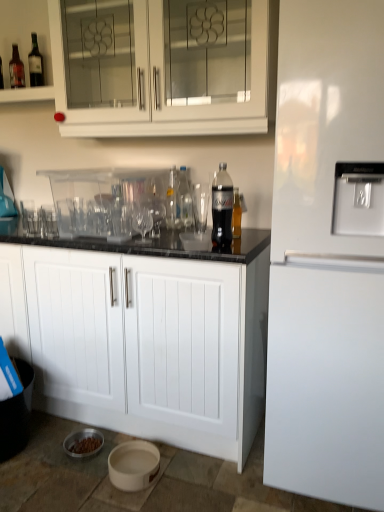
Question: In terms of width, does white glass cabinet at upper center, the first cabinetry when ordered from top to bottom, look wider or thinner when compared to transparent glass shot glass at center, the 2th shot glass in the left-to-right sequence?

Choices:
 (A) wide
 (B) thin

Answer: (A)

Question: From a real-world perspective, relative to transparent glass shot glass at center, the 2th shot glass in the left-to-right sequence, is white glass cabinet at upper center, the second cabinetry in the bottom-to-top sequence, vertically above or below?

Choices:
 (A) above
 (B) below

Answer: (A)

Question: Which of these objects is positioned closest to the white glass cabinet at upper center, the first cabinetry when ordered from top to bottom?

Choices:
 (A) clear glass wine glass at center, which appears as the first wine glass when viewed from the right
 (B) white glossy refrigerator at right
 (C) clear glass bottle at center, which ranks as the third bottle in right-to-left order
 (D) transparent plastic drinking straw at center, which is the 1th drinking straw in front-to-back order
 (E) transparent glass wine glass at center, the 1th wine glass in the left-to-right sequence

Answer: (C)

Question: Which is farther from the white glossy refrigerator at right?

Choices:
 (A) transparent glass wine glass at center, the 2th wine glass viewed from the right
 (B) white glass cabinet at upper center, the second cabinetry in the bottom-to-top sequence
 (C) transparent plastic drinking straw at center, marked as the first drinking straw in a bottom-to-top arrangement
 (D) transparent plastic bottle at center, the third bottle in the front-to-back sequence
 (E) clear glass shot glass at left, arranged as the third shot glass when viewed from the right

Answer: (E)